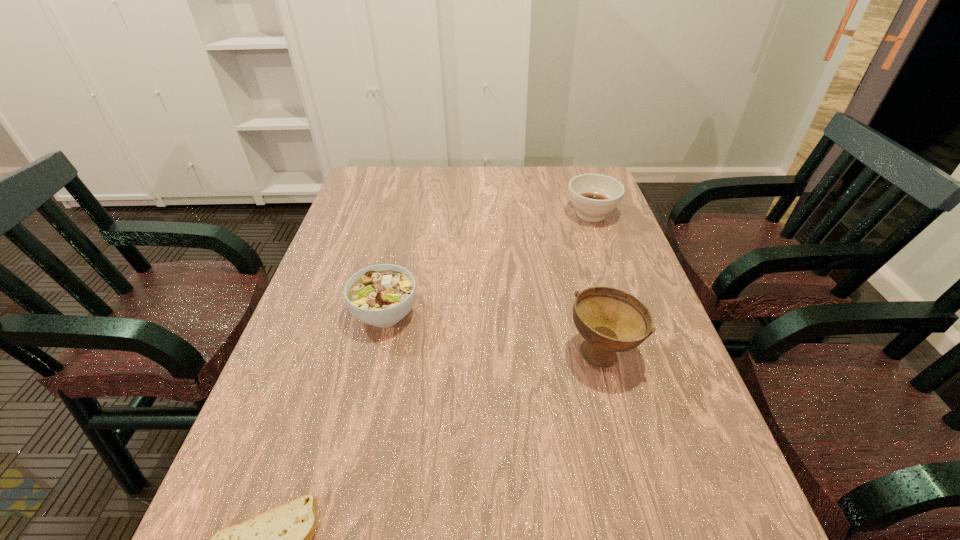
Identify which object is the third nearest to the tallest object. Please provide its 2D coordinates. Your answer should be formatted as a tuple, i.e. [(x, y)], where the tuple contains the x and y coordinates of a point satisfying the conditions above.

[(280, 539)]

At what (x,y) coordinates should I click in order to perform the action: click on the closest object to the farthest soup bowl. Please return your answer as a coordinate pair (x, y). Image resolution: width=960 pixels, height=540 pixels. Looking at the image, I should click on (610, 320).

You are a GUI agent. You are given a task and a screenshot of the screen. Output one action in this format:
    pyautogui.click(x=<x>, y=<y>)
    Task: Click on the second closest soup bowl to the leftmost soup bowl
    The height and width of the screenshot is (540, 960).
    Given the screenshot: What is the action you would take?
    pyautogui.click(x=593, y=195)

Select which soup bowl appears as the second closest to the shortest object. Please provide its 2D coordinates. Your answer should be formatted as a tuple, i.e. [(x, y)], where the tuple contains the x and y coordinates of a point satisfying the conditions above.

[(610, 320)]

Identify the location of free space that satisfies the following two spatial constraints: 1. on the back side of the leftmost soup bowl; 2. on the right side of the farthest soup bowl. The width and height of the screenshot is (960, 540). (408, 214).